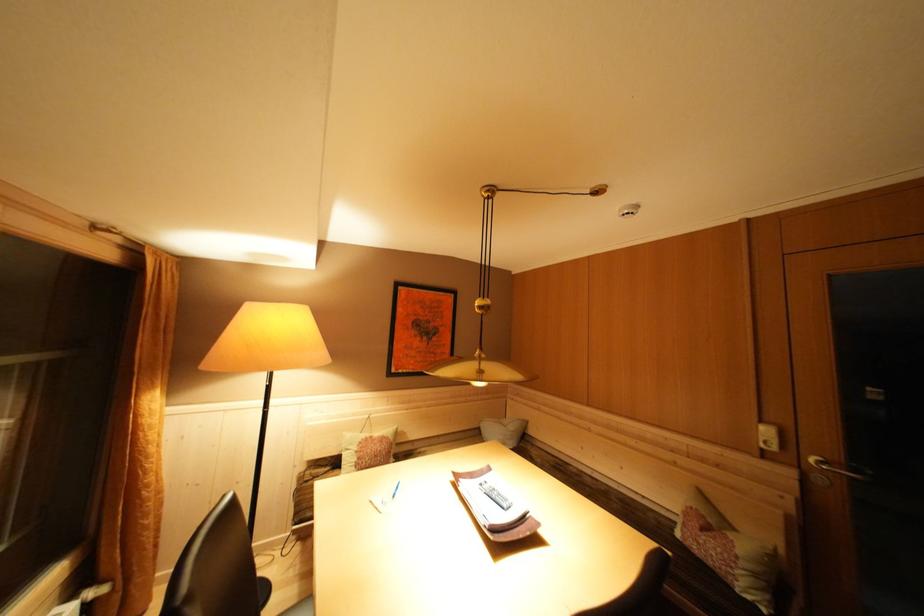
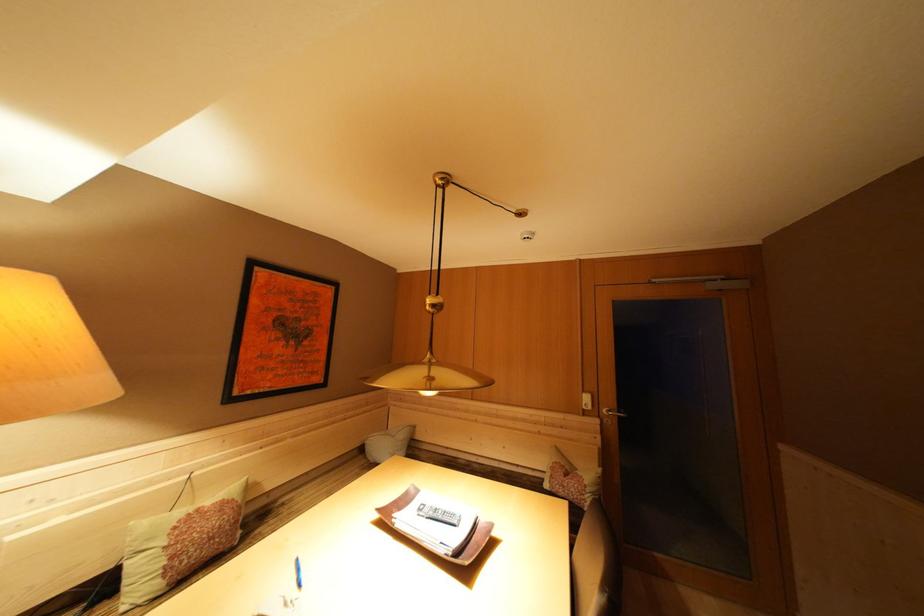
Where in the second image is the point corresponding to point (746, 557) from the first image?

(592, 487)